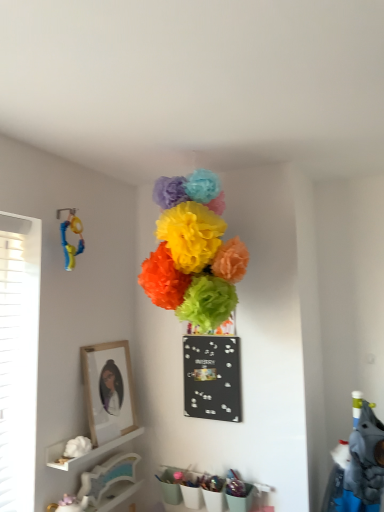
Question: Is point (76, 451) closer or farther from the camera than point (208, 250)?

Choices:
 (A) farther
 (B) closer

Answer: (A)

Question: Is white matte flower at lower left, which appears as the 1th flower when viewed from the left, inside or outside of bright tissue paper flowers at center, which is the second flower in left-to-right order?

Choices:
 (A) inside
 (B) outside

Answer: (B)

Question: Which object is the farthest from the white matte flower at lower left, the 1th flower when ordered from bottom to top?

Choices:
 (A) white matte shelf at lower left
 (B) rubberized yellow and blue toy at left
 (C) bright tissue paper flowers at center, which appears as the 3th flower when ordered from the bottom
 (D) white glossy shelf at lower left
 (E) black matte bulletin board at center

Answer: (C)

Question: Which object is positioned closest to the white matte flower at lower left, which appears as the 1th flower when viewed from the left?

Choices:
 (A) green tissue paper at center, which is the third flower in left-to-right order
 (B) bright tissue paper flowers at center, which appears as the 3th flower when ordered from the bottom
 (C) rubberized yellow and blue toy at left
 (D) wooden framed portrait at left
 (E) white matte shelf at lower left

Answer: (E)